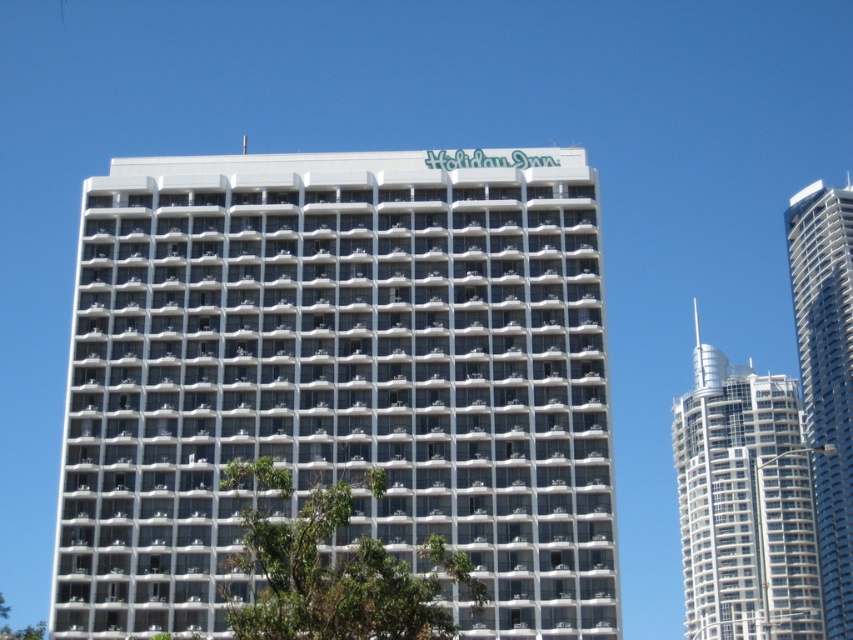
Based on the scene description, where is the green leafy tree at center located in terms of coordinates?

The green leafy tree at center is located at coordinates (x=341, y=579).

You are standing in front of the Holiday Inn and want to take a photo of the building without the green leafy tree at center blocking the view. Based on their sizes, can you estimate whether the white glass building at center will completely cover the tree in the photo?

The white glass building at center is larger than the green leafy tree at center, so it will completely cover the tree in the photo.